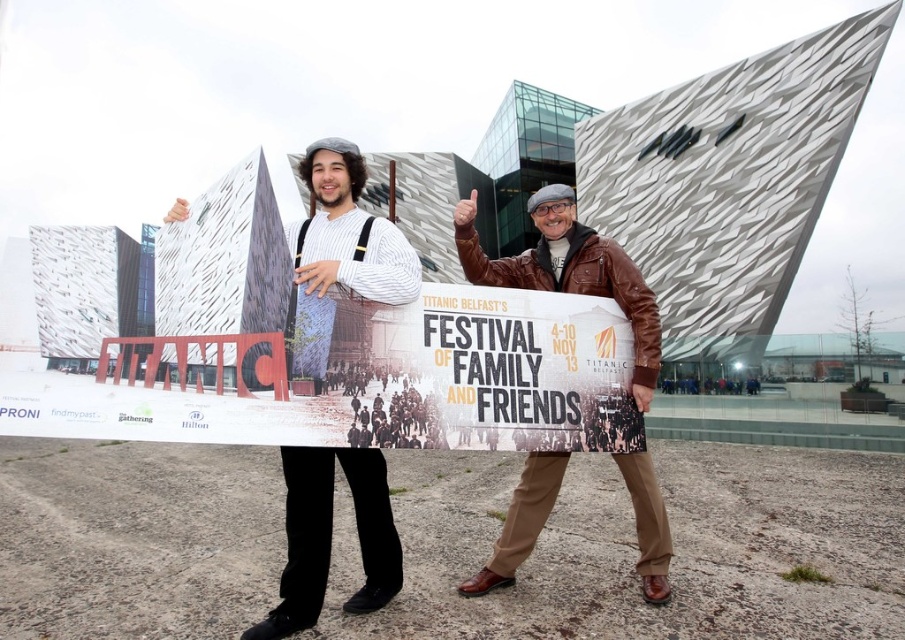
Question: Observing the image, what is the correct spatial positioning of striped sweater at center in reference to brown leather jacket at center?

Choices:
 (A) left
 (B) right

Answer: (A)

Question: Which object appears farthest from the camera in this image?

Choices:
 (A) striped sweater at center
 (B) brown leather jacket at center

Answer: (B)

Question: Observing the image, what is the correct spatial positioning of striped sweater at center in reference to brown leather jacket at center?

Choices:
 (A) left
 (B) right

Answer: (A)

Question: Can you confirm if striped sweater at center is bigger than brown leather jacket at center?

Choices:
 (A) yes
 (B) no

Answer: (A)